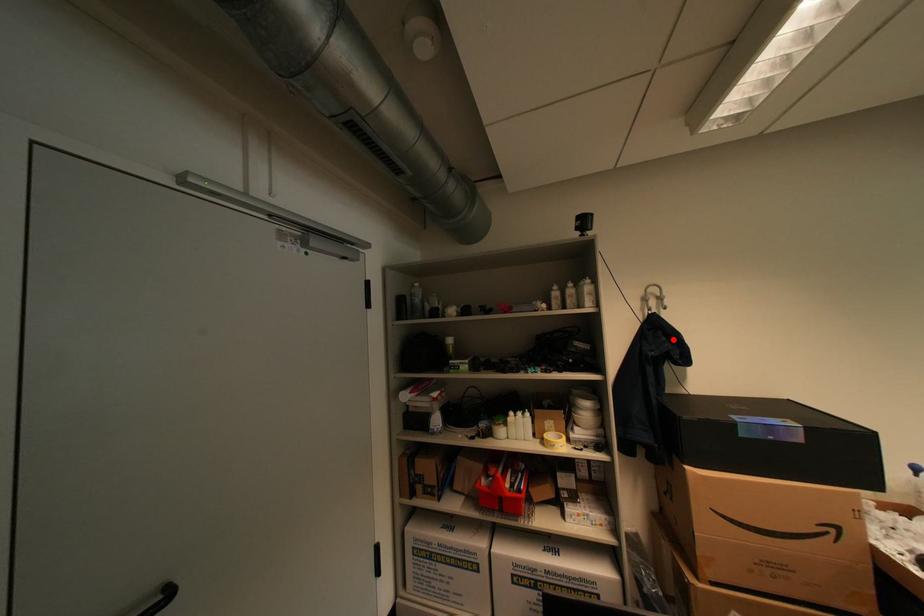
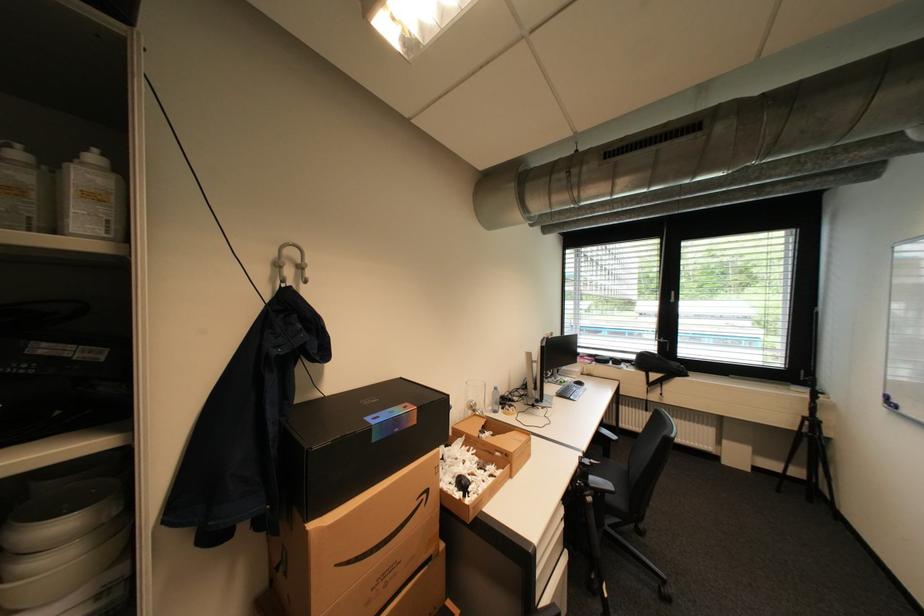
Find the pixel in the second image that matches the highlighted location in the first image.

(309, 326)